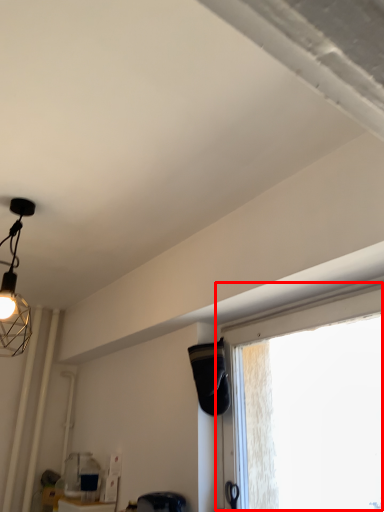
Question: From the image's perspective, considering the relative positions of window (annotated by the red box) and swivel chair in the image provided, where is window (annotated by the red box) located with respect to the staircase?

Choices:
 (A) below
 (B) above

Answer: (B)